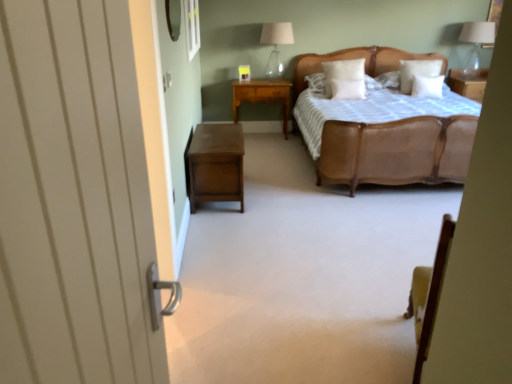
Question: Considering the relative positions of leather bed at center and brown wood nightstand at lower left, marked as the 2th nightstand in a top-to-bottom arrangement, in the image provided, is leather bed at center behind brown wood nightstand at lower left, marked as the 2th nightstand in a top-to-bottom arrangement,?

Choices:
 (A) no
 (B) yes

Answer: (B)

Question: Is leather bed at center thinner than brown wood nightstand at lower left, which appears as the first nightstand when ordered from the bottom?

Choices:
 (A) no
 (B) yes

Answer: (A)

Question: Can you confirm if leather bed at center is shorter than brown wood nightstand at lower left, acting as the 2th nightstand starting from the back?

Choices:
 (A) no
 (B) yes

Answer: (A)

Question: Considering the relative positions of leather bed at center and brown wood nightstand at lower left, acting as the 2th nightstand starting from the back, in the image provided, is leather bed at center to the left of brown wood nightstand at lower left, acting as the 2th nightstand starting from the back, from the viewer's perspective?

Choices:
 (A) no
 (B) yes

Answer: (A)

Question: From the image's perspective, is leather bed at center below brown wood nightstand at lower left, acting as the 2th nightstand starting from the back?

Choices:
 (A) no
 (B) yes

Answer: (A)

Question: From the image's perspective, relative to brown wood nightstand at lower left, the first nightstand in the front-to-back sequence, is transparent glass window at upper center above or below?

Choices:
 (A) below
 (B) above

Answer: (B)

Question: Is transparent glass window at upper center wider or thinner than brown wood nightstand at lower left, the first nightstand in the front-to-back sequence?

Choices:
 (A) wide
 (B) thin

Answer: (B)

Question: Is transparent glass window at upper center taller or shorter than brown wood nightstand at lower left, the first nightstand in the front-to-back sequence?

Choices:
 (A) short
 (B) tall

Answer: (B)

Question: Considering the relative positions of transparent glass window at upper center and brown wood nightstand at lower left, marked as the 2th nightstand in a top-to-bottom arrangement, in the image provided, is transparent glass window at upper center to the left or to the right of brown wood nightstand at lower left, marked as the 2th nightstand in a top-to-bottom arrangement,?

Choices:
 (A) left
 (B) right

Answer: (A)

Question: In terms of size, does transparent glass table lamp at upper right, which is the second table lamp from left to right, appear bigger or smaller than white soft pillow at upper center, the third pillow positioned from the left?

Choices:
 (A) small
 (B) big

Answer: (B)

Question: Relative to white soft pillow at upper center, the third pillow positioned from the left, is transparent glass table lamp at upper right, which is the second table lamp from left to right, in front or behind?

Choices:
 (A) front
 (B) behind

Answer: (B)

Question: Would you say transparent glass table lamp at upper right, the first table lamp in the right-to-left sequence, is to the left or to the right of white soft pillow at upper center, the third pillow positioned from the left, in the picture?

Choices:
 (A) left
 (B) right

Answer: (B)

Question: From a real-world perspective, is transparent glass table lamp at upper right, which is the second table lamp from left to right, positioned above or below white soft pillow at upper center, which appears as the second pillow when viewed from the right?

Choices:
 (A) below
 (B) above

Answer: (B)

Question: From the image's perspective, is white soft pillow at center, the second pillow when ordered from left to right, positioned above or below clear glass table lamp at upper center, which is the 2th table lamp in right-to-left order?

Choices:
 (A) above
 (B) below

Answer: (B)

Question: Looking at the image, does white soft pillow at center, the second pillow when ordered from left to right, seem bigger or smaller compared to clear glass table lamp at upper center, which appears as the 1th table lamp when viewed from the left?

Choices:
 (A) big
 (B) small

Answer: (B)